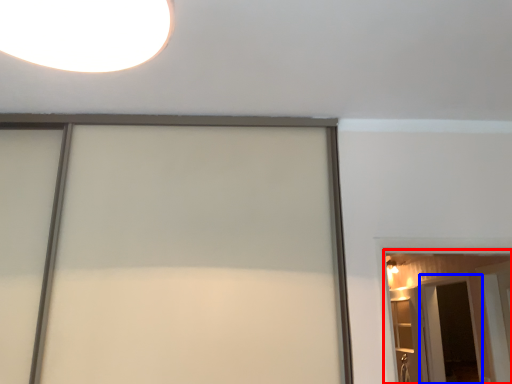
Question: Which object is closer to the camera taking this photo, barn door (highlighted by a red box) or screen door (highlighted by a blue box)?

Choices:
 (A) barn door
 (B) screen door

Answer: (A)